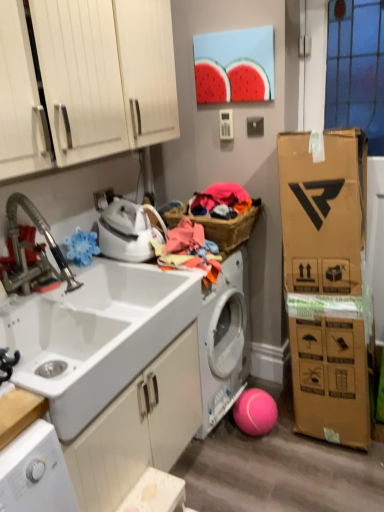
Question: Based on their sizes in the image, would you say white glossy sink at left is bigger or smaller than woven wicker basket at center?

Choices:
 (A) small
 (B) big

Answer: (B)

Question: Considering the positions of white glossy sink at left and woven wicker basket at center in the image, is white glossy sink at left taller or shorter than woven wicker basket at center?

Choices:
 (A) tall
 (B) short

Answer: (A)

Question: Estimate the real-world distances between objects in this image. Which object is closer to the white matte washing machine at center?

Choices:
 (A) brushed metal faucet at left
 (B) white matte cabinet at lower center, the second cabinetry viewed from the top
 (C) multicolored fabric at center
 (D) white glossy sink at left
 (E) woven wicker basket at center

Answer: (B)

Question: Based on their relative distances, which object is nearer to the white matte cabinet at lower center, the second cabinetry viewed from the top?

Choices:
 (A) white glossy cabinet doors at upper left, arranged as the 2th cabinetry when ordered from the bottom
 (B) multicolored fabric at center
 (C) woven wicker basket at center
 (D) white matte washing machine at center
 (E) brushed metal faucet at left

Answer: (D)